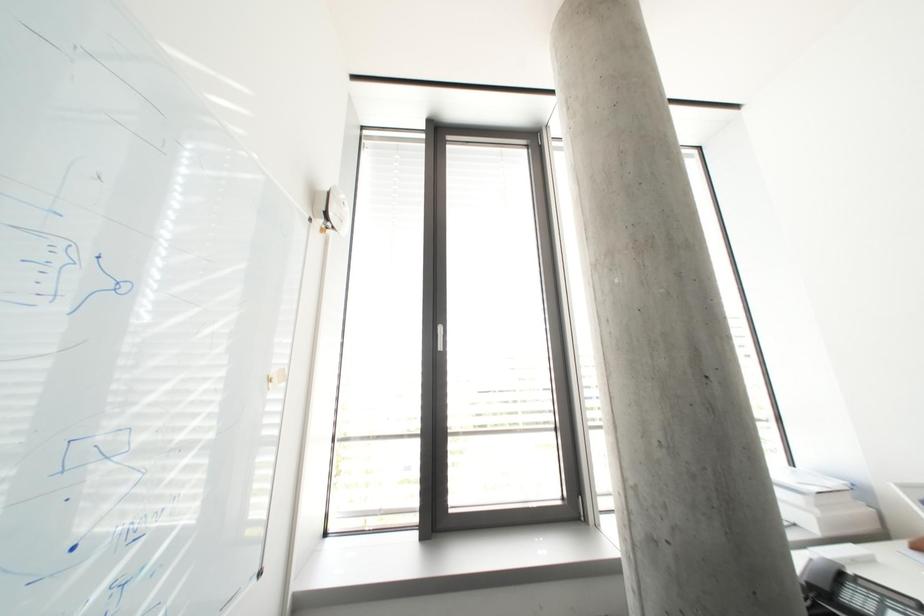
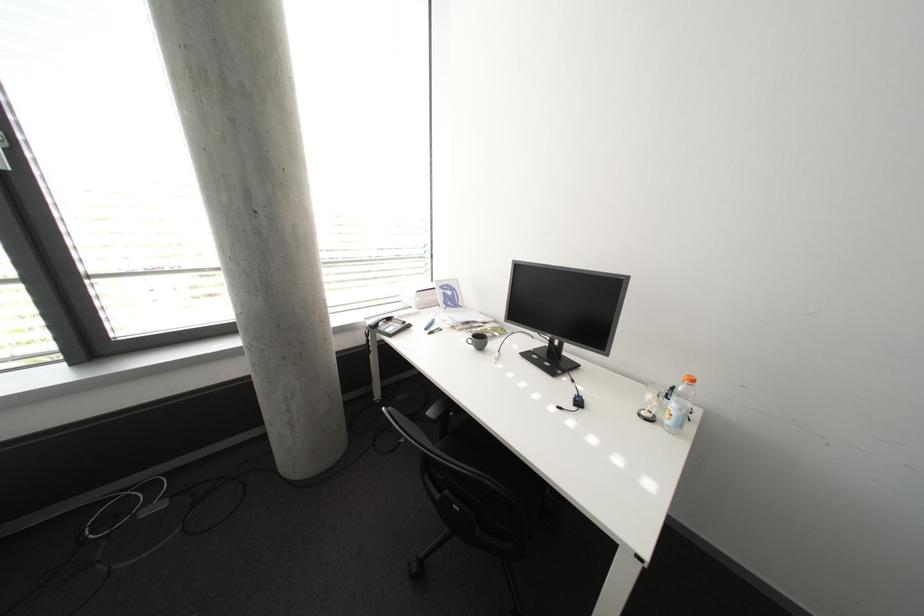
Consider the image. First-person continuous shooting, in which direction is the camera rotating?

The camera rotated toward right-down.